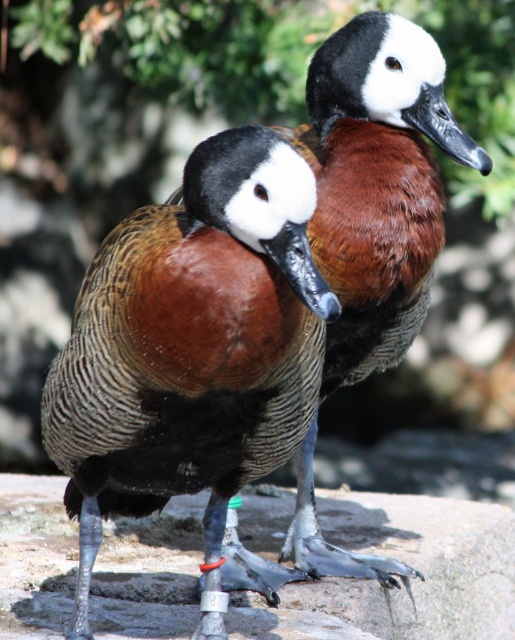
Consider the image. You are a researcher observing two ducks on a rocky surface. You notice a gray stone at center and a brown feathered duck at center. Which object is bigger?

The gray stone at center is larger in size than the brown feathered duck at center.

You are a researcher observing ducks in their natural habitat. You notice a gray stone at center and a brown feathered duck at center. Which object is positioned lower in the image?

The gray stone at center is positioned below the brown feathered duck at center, so it is lower in the image.

You are a researcher observing ducks in their natural habitat. You notice a brown speckled duck at center and a green leafy branch at upper left. Which object is closer to the point marked at coordinates (191, 346)?

The brown speckled duck at center is located exactly at the point marked at coordinates (191, 346), so it is the closest object to that point.